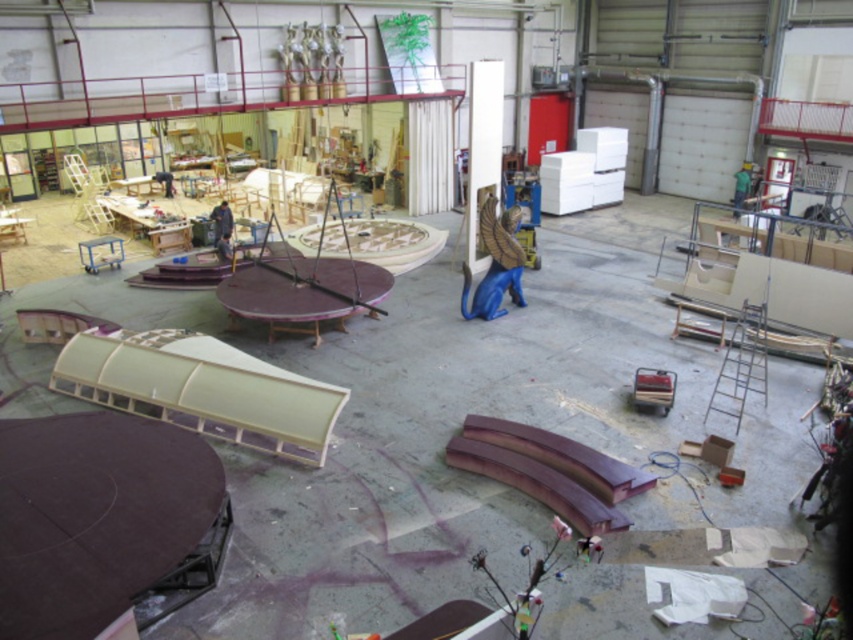
Question: Which of the following is the farthest from the observer?

Choices:
 (A) green fabric person at upper right
 (B) blue matte statue at center

Answer: (A)

Question: Can you confirm if blue fabric at center is wider than dark blue fabric at center?

Choices:
 (A) no
 (B) yes

Answer: (A)

Question: Which of the following is the farthest from the observer?

Choices:
 (A) blue fabric at center
 (B) green fabric person at upper right

Answer: (B)

Question: Is the position of blue matte statue at center less distant than that of dark blue fabric at center?

Choices:
 (A) no
 (B) yes

Answer: (B)

Question: Which object is closer to the camera taking this photo?

Choices:
 (A) blue fabric at center
 (B) blue matte statue at center
 (C) green fabric person at upper right

Answer: (B)

Question: Is blue matte statue at center smaller than green fabric person at upper right?

Choices:
 (A) yes
 (B) no

Answer: (B)